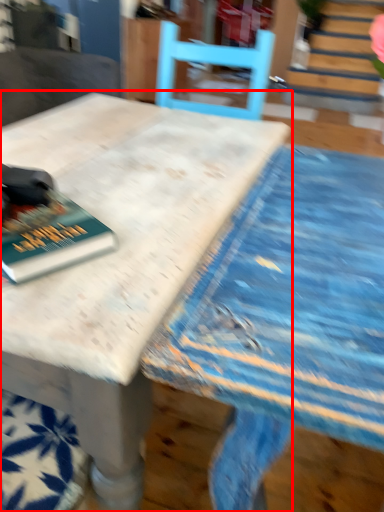
Question: From the image, what is the correct spatial relationship of table (annotated by the red box) in relation to book?

Choices:
 (A) right
 (B) left

Answer: (A)